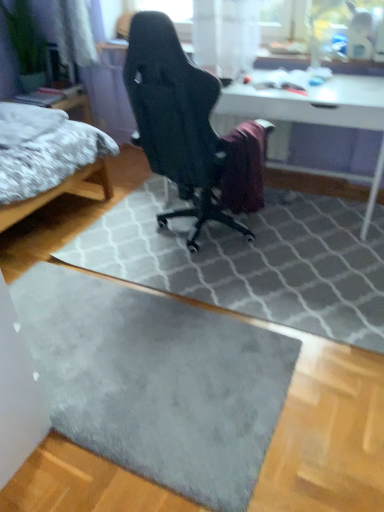
Locate an element on the screen. Image resolution: width=384 pixels, height=512 pixels. free area in between white glossy table at center and black mesh chair at center is located at coordinates (278, 241).